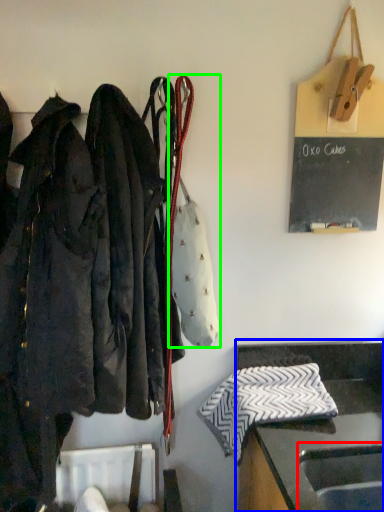
Question: Estimate the real-world distances between objects in this image. Which object is closer to sink (highlighted by a red box), furniture (highlighted by a blue box) or handbag (highlighted by a green box)?

Choices:
 (A) furniture
 (B) handbag

Answer: (A)